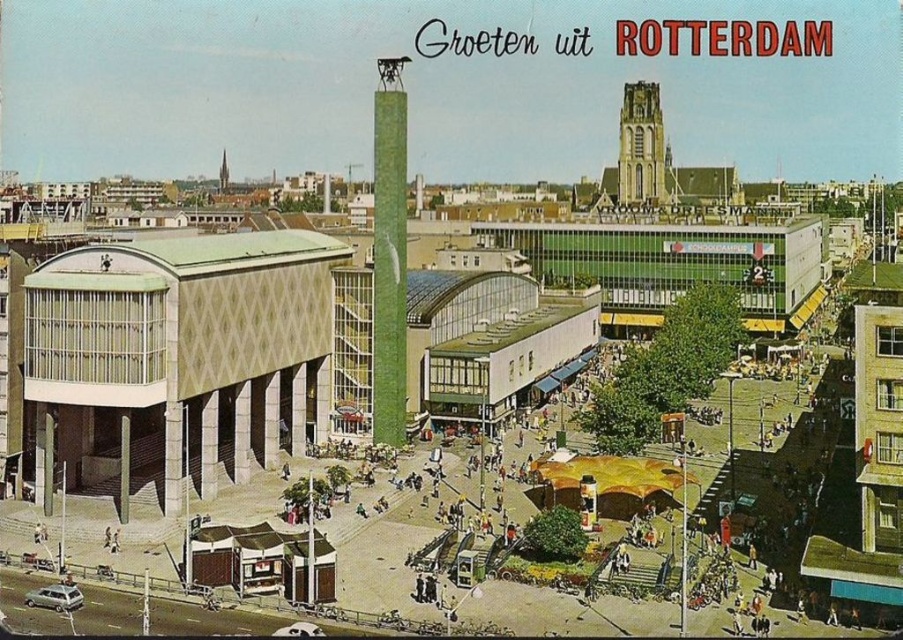
Image resolution: width=903 pixels, height=640 pixels. What do you see at coordinates (389, 253) in the screenshot? I see `green textured tower at center` at bounding box center [389, 253].

Find the location of a particular element. The width and height of the screenshot is (903, 640). green textured tower at center is located at coordinates (389, 253).